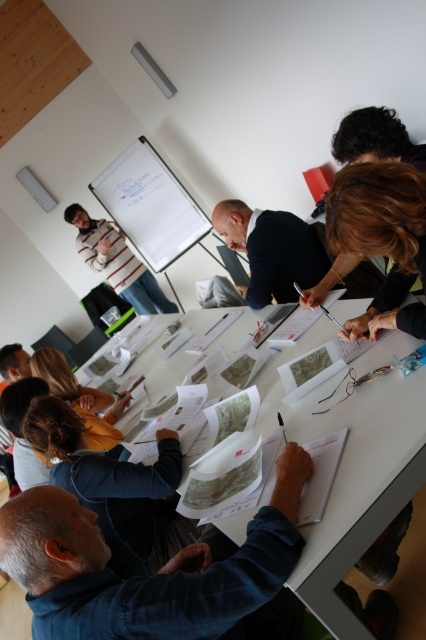
Question: Which is nearer to the white paper at center?

Choices:
 (A) striped cotton shirt at upper left
 (B) dark blue suit at center

Answer: (B)

Question: Which object appears farthest from the camera in this image?

Choices:
 (A) dark blue suit at center
 (B) white paper at center
 (C) striped cotton shirt at upper left

Answer: (C)

Question: Is white paper at center wider than striped cotton shirt at upper left?

Choices:
 (A) yes
 (B) no

Answer: (A)

Question: Among these points, which one is nearest to the camera?

Choices:
 (A) (351, 624)
 (B) (250, 256)

Answer: (A)

Question: Does white paper at center have a greater width compared to striped cotton shirt at upper left?

Choices:
 (A) yes
 (B) no

Answer: (A)

Question: From the image, what is the correct spatial relationship of white paper at center in relation to striped cotton shirt at upper left?

Choices:
 (A) left
 (B) right

Answer: (B)